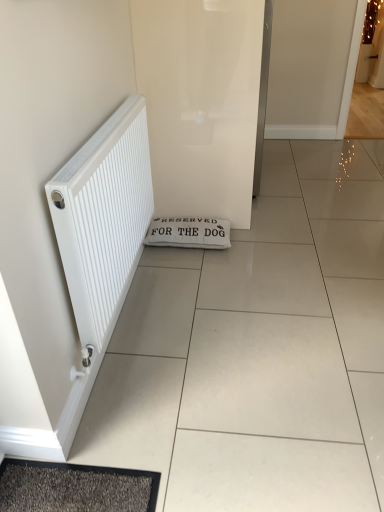
At what (x,y) coordinates should I click in order to perform the action: click on free spot above white matte radiator at left (from a real-world perspective). Please return your answer as a coordinate pair (x, y). This screenshot has width=384, height=512. Looking at the image, I should click on (108, 126).